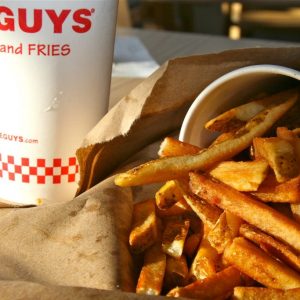
Where is `cup`? cup is located at coordinates (59, 98).